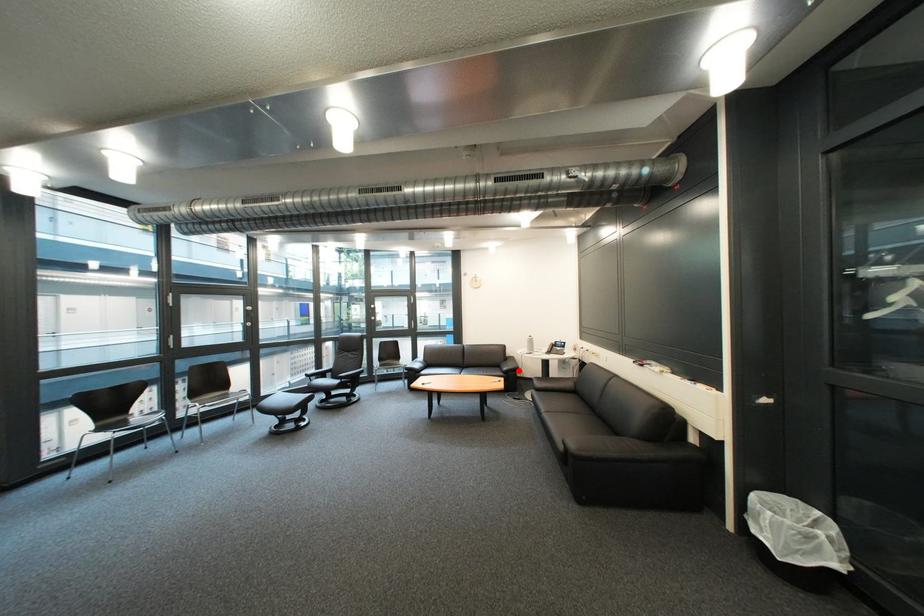
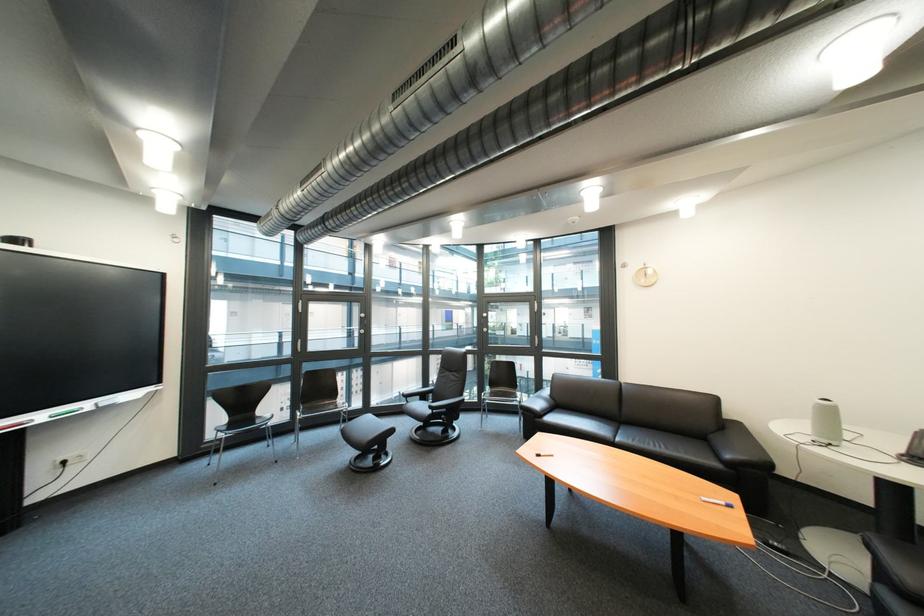
The point at the highlighted location is marked in the first image. Where is the corresponding point in the second image?

(742, 458)